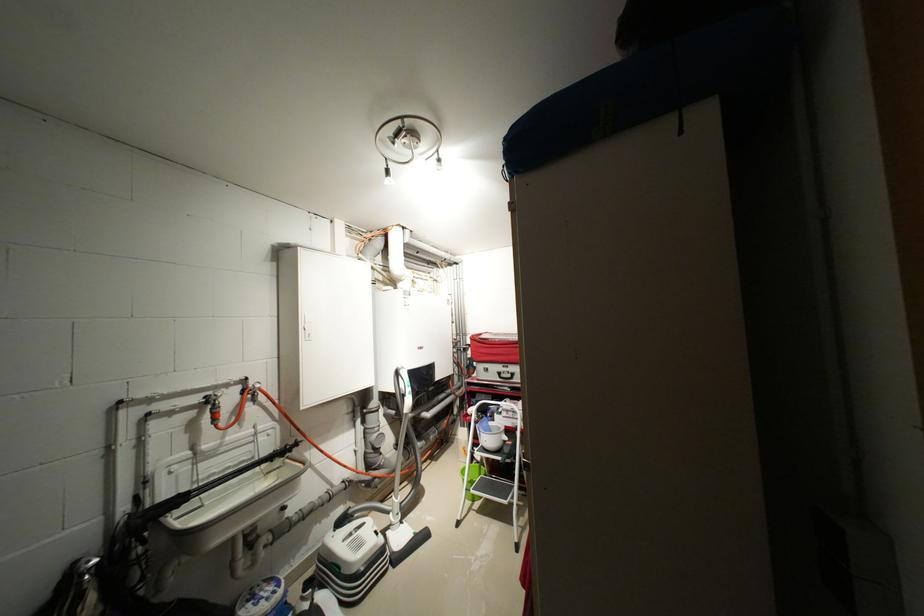
Find the location of a particular element. The width and height of the screenshot is (924, 616). step stool handle is located at coordinates (515, 456).